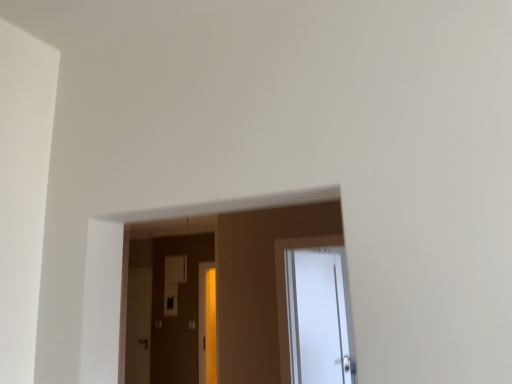
The height and width of the screenshot is (384, 512). What do you see at coordinates (285, 290) in the screenshot?
I see `white glossy door at center` at bounding box center [285, 290].

Locate an element on the screen. white glossy door at center is located at coordinates (285, 290).

Measure the distance between white glossy door at center and camera.

3.17 meters.

In order to face matte white screen door at center, should I rotate leftwards or rightwards?

You should rotate left by 15.364 degrees.

Describe the element at coordinates (138, 326) in the screenshot. I see `matte white screen door at center` at that location.

Identify the location of matte white screen door at center. (138, 326).

Where is `white glossy door at center`? The height and width of the screenshot is (384, 512). white glossy door at center is located at coordinates (285, 290).

Is matte white screen door at center at the right side of white glossy door at center?

In fact, matte white screen door at center is to the left of white glossy door at center.

Considering the relative positions of matte white screen door at center and white glossy door at center in the image provided, is matte white screen door at center in front of white glossy door at center?

No, matte white screen door at center is behind white glossy door at center.

Does point (145, 366) lie behind point (287, 331)?

Yes, it is behind point (287, 331).

From the image's perspective, which is below, matte white screen door at center or white glossy door at center?

matte white screen door at center is shown below in the image.

From a real-world perspective, between matte white screen door at center and white glossy door at center, who is vertically lower?

matte white screen door at center.

Is matte white screen door at center wider than white glossy door at center?

Incorrect, the width of matte white screen door at center does not surpass that of white glossy door at center.

Which of these two, matte white screen door at center or white glossy door at center, stands shorter?

white glossy door at center is shorter.

Considering the relative sizes of matte white screen door at center and white glossy door at center in the image provided, is matte white screen door at center bigger than white glossy door at center?

No.

Is matte white screen door at center inside or outside of white glossy door at center?

matte white screen door at center lies outside white glossy door at center.

Are matte white screen door at center and white glossy door at center far apart?

matte white screen door at center is far away from white glossy door at center.

Consider the image. Is matte white screen door at center positioned with its back to white glossy door at center?

matte white screen door at center does not have its back to white glossy door at center.

Find the location of a particular element. The width and height of the screenshot is (512, 384). screen door behind the white glossy door at center is located at coordinates (138, 326).

Considering the positions of objects white glossy door at center and matte white screen door at center in the image provided, who is more to the left, white glossy door at center or matte white screen door at center?

matte white screen door at center.

Does white glossy door at center come in front of matte white screen door at center?

Yes, it is.

Which is nearer, (279, 350) or (144, 287)?

Point (279, 350) appears to be closer to the viewer than point (144, 287).

From the image's perspective, relative to matte white screen door at center, is white glossy door at center above or below?

Based on their image positions, white glossy door at center is located above matte white screen door at center.

From a real-world perspective, which object stands above the other?

white glossy door at center.

Which object is wider, white glossy door at center or matte white screen door at center?

Wider between the two is white glossy door at center.

From their relative heights in the image, would you say white glossy door at center is taller or shorter than matte white screen door at center?

Considering their sizes, white glossy door at center has less height than matte white screen door at center.

Which of these two, white glossy door at center or matte white screen door at center, is smaller?

matte white screen door at center.

Is white glossy door at center not inside matte white screen door at center?

That's correct, white glossy door at center is outside of matte white screen door at center.

Is white glossy door at center placed right next to matte white screen door at center?

They are not placed beside each other.

Is white glossy door at center oriented towards matte white screen door at center?

No, white glossy door at center is not turned towards matte white screen door at center.

Measure the distance from white glossy door at center to matte white screen door at center.

white glossy door at center is 10.26 feet from matte white screen door at center.

The width and height of the screenshot is (512, 384). I want to click on screen door that appears below the white glossy door at center (from the image's perspective), so click(138, 326).

The height and width of the screenshot is (384, 512). In order to click on door lying above the matte white screen door at center (from the image's perspective) in this screenshot , I will do `click(285, 290)`.

Locate an element on the screen. This screenshot has height=384, width=512. door on the right side of matte white screen door at center is located at coordinates (285, 290).